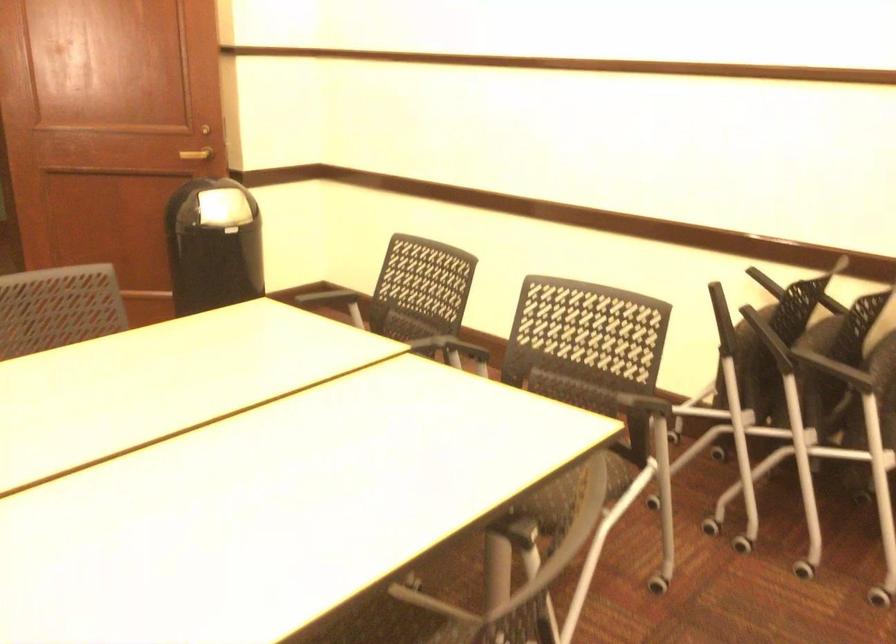
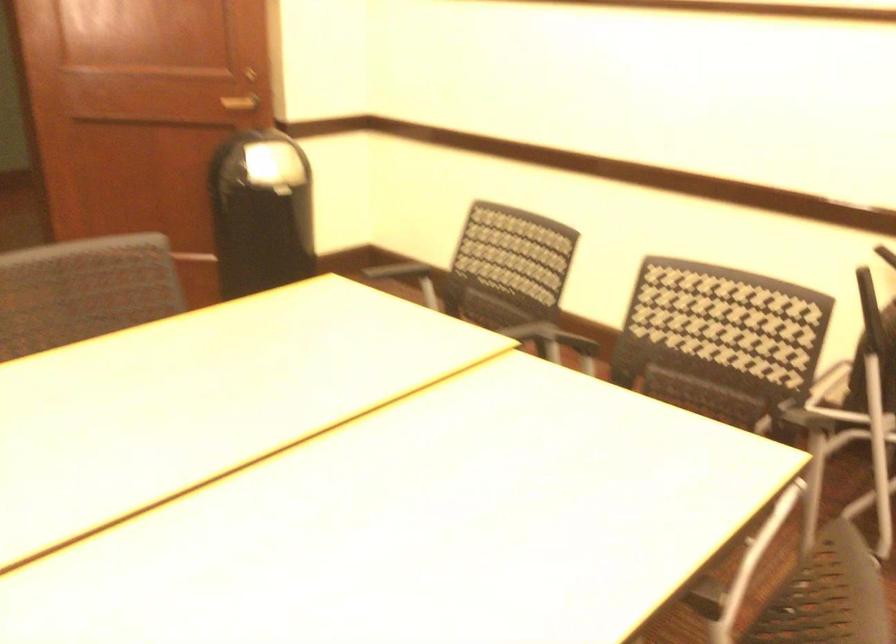
In the second image, find the point that corresponds to pixel 355 343 in the first image.

(446, 332)